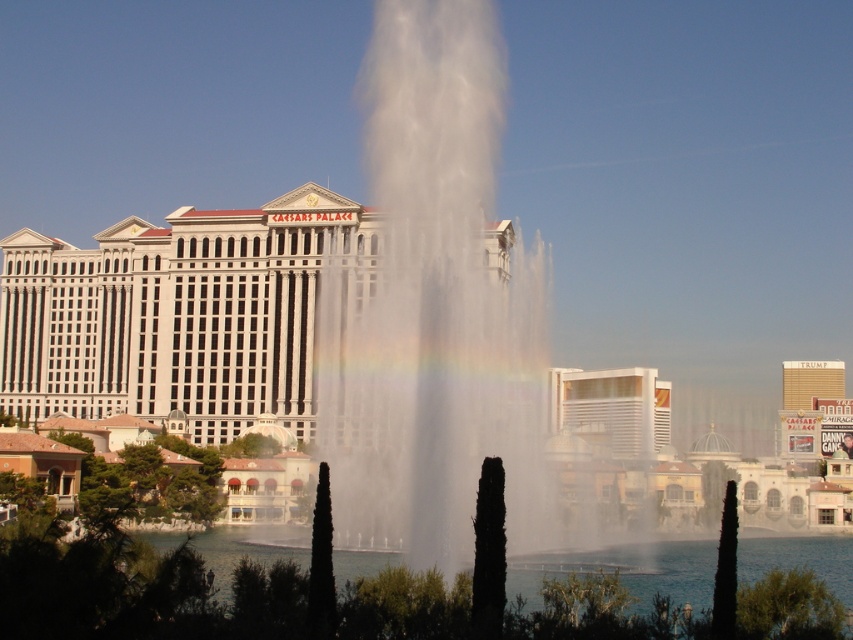
Question: Does white marble building at center have a larger size compared to white glossy hotel at center?

Choices:
 (A) yes
 (B) no

Answer: (A)

Question: Among these points, which one is nearest to the camera?

Choices:
 (A) (442, 161)
 (B) (10, 321)
 (C) (612, 593)
 (D) (657, 380)

Answer: (C)

Question: Among these points, which one is nearest to the camera?

Choices:
 (A) (405, 600)
 (B) (189, 332)

Answer: (A)

Question: Is white marble building at center to the right of clear water at center from the viewer's perspective?

Choices:
 (A) no
 (B) yes

Answer: (A)

Question: Does white frothy water at center come behind white glossy hotel at center?

Choices:
 (A) no
 (B) yes

Answer: (A)

Question: Which object appears farthest from the camera in this image?

Choices:
 (A) white frothy water at center
 (B) white marble building at center

Answer: (B)